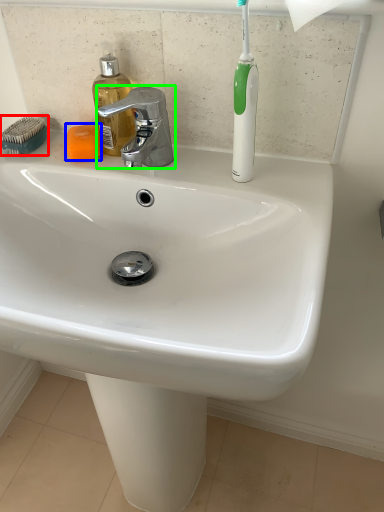
Question: Estimate the real-world distances between objects in this image. Which object is closer to comb (highlighted by a red box), soap (highlighted by a blue box) or tap (highlighted by a green box)?

Choices:
 (A) soap
 (B) tap

Answer: (A)